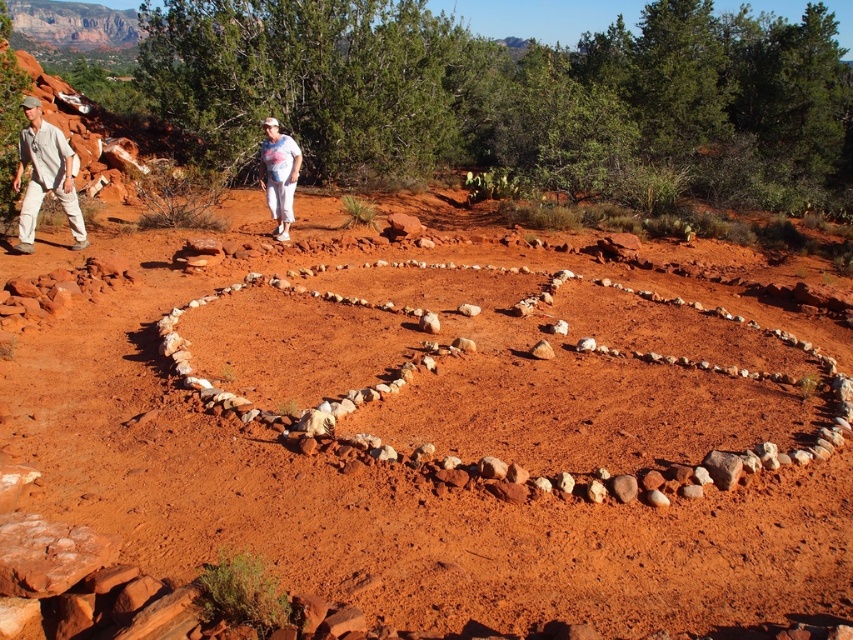
Question: Is matte khaki pants at left to the left of white tie-dye shirt at center from the viewer's perspective?

Choices:
 (A) no
 (B) yes

Answer: (B)

Question: Can you confirm if matte khaki pants at left is wider than light beige pants at left?

Choices:
 (A) yes
 (B) no

Answer: (B)

Question: Considering the real-world distances, which object is farthest from the matte khaki pants at left?

Choices:
 (A) reddish-brown soil at center
 (B) light beige pants at left
 (C) white tie-dye shirt at center

Answer: (A)

Question: Among these points, which one is farthest from the camera?

Choices:
 (A) (288, 196)
 (B) (85, 243)

Answer: (A)

Question: Is reddish-brown soil at center below matte khaki pants at left?

Choices:
 (A) yes
 (B) no

Answer: (A)

Question: Which point is closer to the camera?

Choices:
 (A) light beige pants at left
 (B) reddish-brown soil at center
 (C) matte khaki pants at left
 (D) white tie-dye shirt at center

Answer: (B)